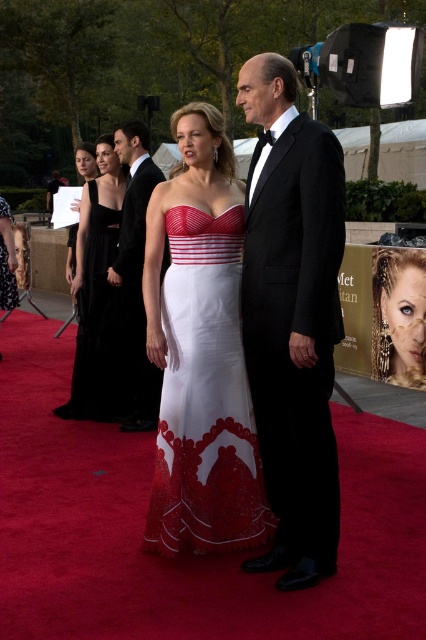
You are a photographer at the event and need to adjust the camera focus. Which object between the black satin tuxedo at center and the black velvet dress at left is shorter?

The black satin tuxedo at center is shorter than the black velvet dress at left.